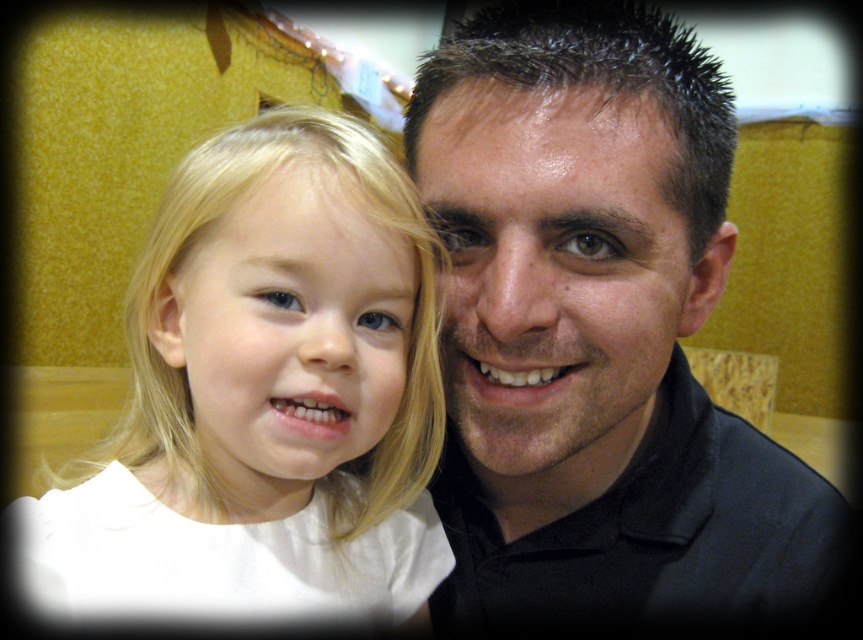
Which is more to the left, smooth skin face at center or smooth blonde hair at left?

smooth blonde hair at left is more to the left.

I want to click on smooth skin face at center, so click(x=555, y=273).

Locate an element on the screen. smooth skin face at center is located at coordinates (555, 273).

Which is more to the right, black matte shirt at center or smooth skin face at center?

Positioned to the right is black matte shirt at center.

Is point (591, 556) farther from camera compared to point (499, 285)?

That is True.

I want to click on black matte shirt at center, so click(x=596, y=332).

Identify the location of white matte hair at center. (266, 394).

Describe the element at coordinates (266, 394) in the screenshot. I see `white matte hair at center` at that location.

Locate an element on the screen. The height and width of the screenshot is (640, 863). white matte hair at center is located at coordinates (266, 394).